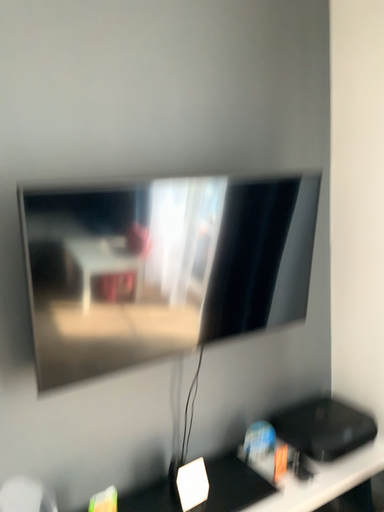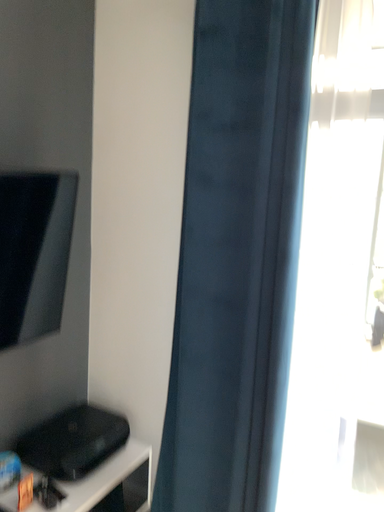
Question: Which way did the camera rotate in the video?

Choices:
 (A) rotated right
 (B) rotated left

Answer: (A)